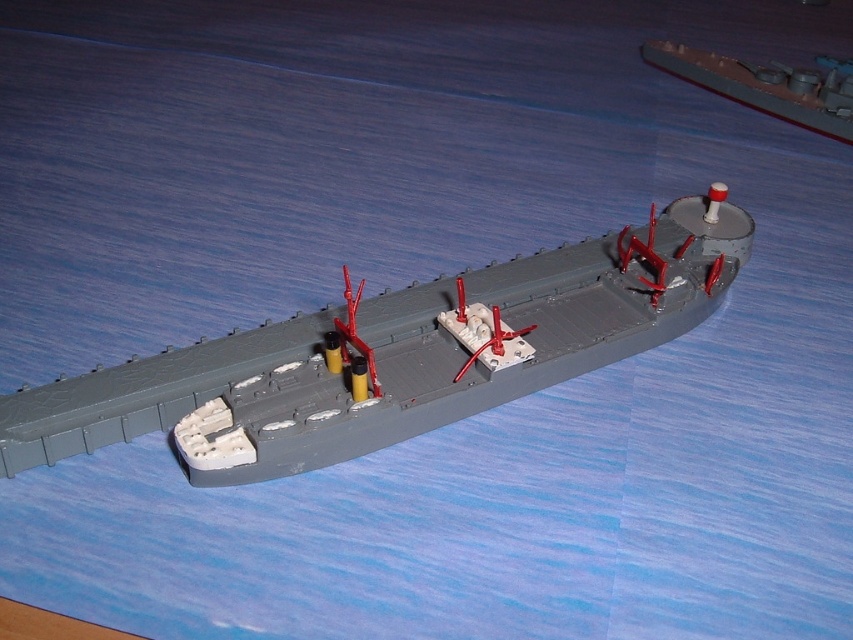
You are a model ship collector who wants to display both the gray matte ship at center and the gray matte ship at upper right on a shelf. The shelf has a width of 22 inches. Can both ships be placed side by side without overlapping?

The gray matte ship at center is 21.51 inches away from the gray matte ship at upper right, so yes, both ships can be placed side by side on the 22 inch shelf since the distance between them is less than the shelf width.